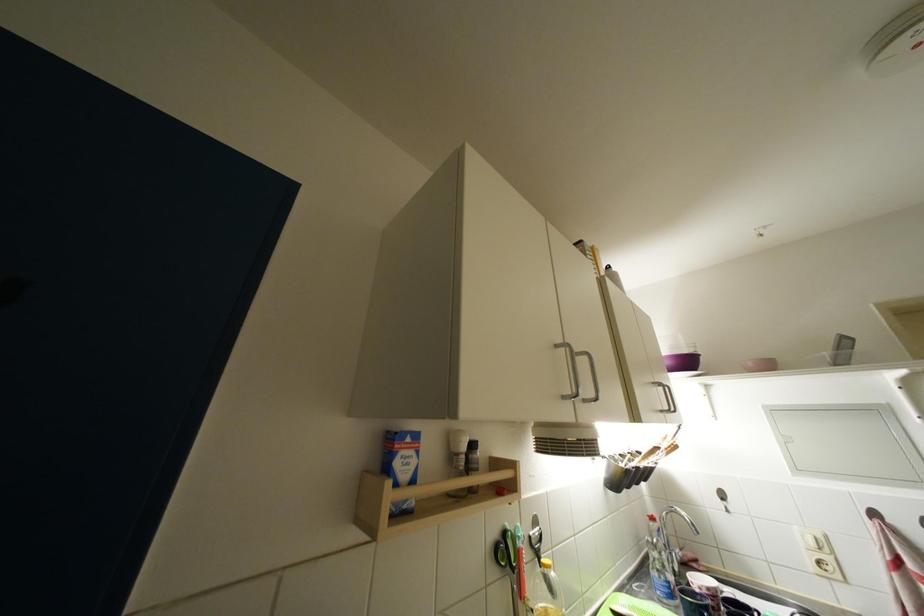
Find where to shak the white spice shaker. Please return your answer as a coordinate pair (x, y).

(457, 458)